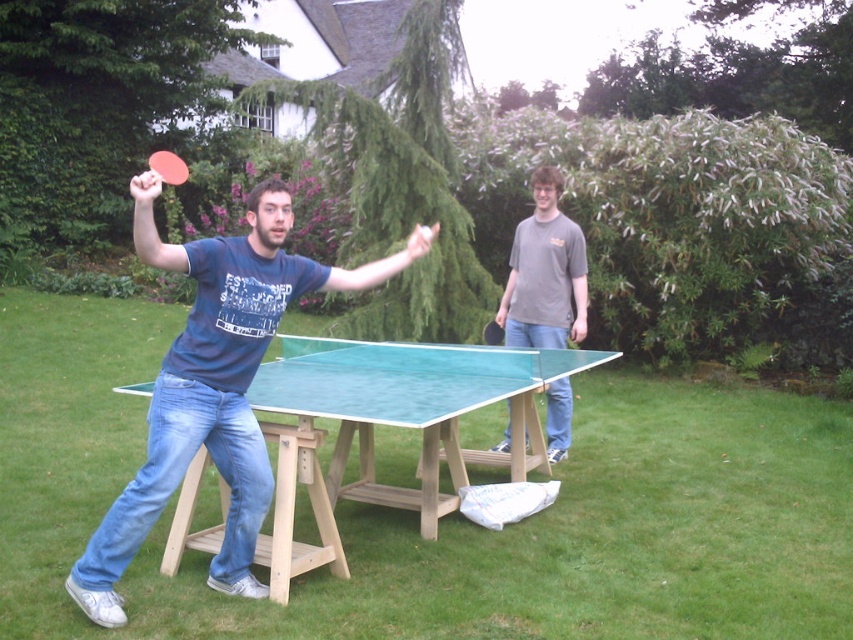
You are standing at the point labeled point [498,344] and want to walk towards the point labeled point [252,595]. Based on the scene description, which direction should you move relative to your current position?

You should move forward because point [252,595] is in front of point [498,344].

You are standing at the position of the point labeled as point (544, 273) in the image. What object is located exactly at that point?

The point labeled as point (544, 273) corresponds to the gray cotton tshirt at center.